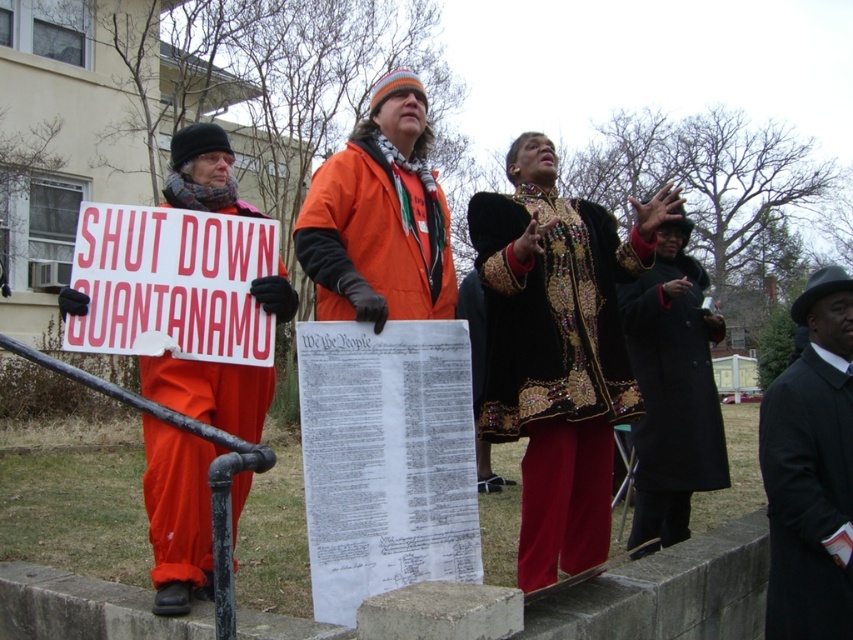
You are a photographer at the protest scene. You want to capture a photo of the velvet black robe at center and the red plastic sign at center. Which object should you focus on first to ensure it appears in the foreground of the photo?

The velvet black robe at center is positioned under the red plastic sign at center, so focusing on the red plastic sign at center first will place it in the foreground.

You are a photographer standing at the camera position. You want to take a photo of the black wool coat at right without moving the camera. Is the coat within the camera frame? The camera has a 5 meter focal length range.

The black wool coat at right is 3.41 meters away from the camera, which is within the 5 meter focal length range. Therefore, the coat is within the camera frame.

You are a photographer trying to capture a clear photo of the protest signs. You notice the velvet black robe at center and the red plastic sign at center. Which object should you focus on to ensure it doesn not get obscured by the other?

The velvet black robe at center is wider than the red plastic sign at center, so focusing on the red plastic sign at center would reduce the chance of it being blocked by the robe.